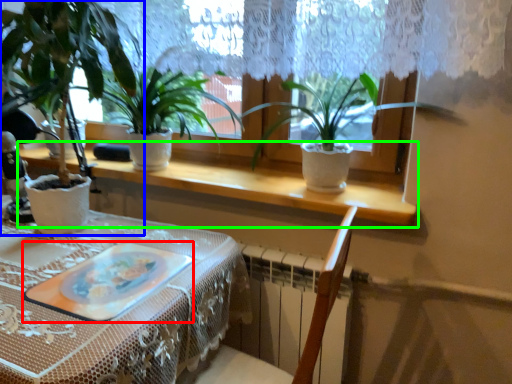
Question: Which is nearer to the platter (highlighted by a red box)? houseplant (highlighted by a blue box) or window sill (highlighted by a green box).

Choices:
 (A) houseplant
 (B) window sill

Answer: (B)